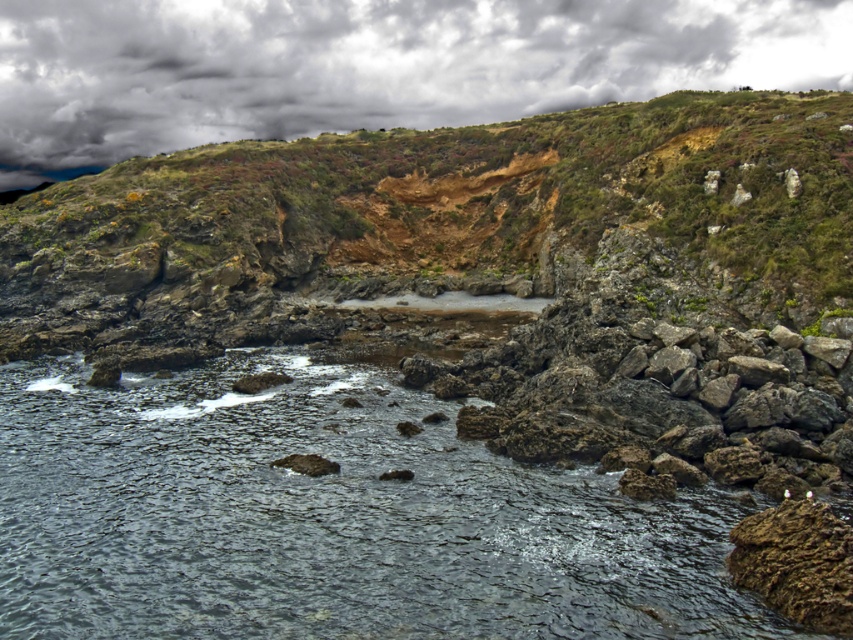
Question: Is dark gray water at center closer to the viewer compared to rugged rock cliff at center?

Choices:
 (A) no
 (B) yes

Answer: (B)

Question: Where is rugged rock cliff at center located in relation to cloudy gray sky at upper center in the image?

Choices:
 (A) below
 (B) above

Answer: (A)

Question: Considering the real-world distances, which object is closest to the dark gray water at center?

Choices:
 (A) rugged rock cliff at center
 (B) cloudy gray sky at upper center
 (C) rough stone cliff at center

Answer: (C)

Question: Which object is closer to the camera taking this photo?

Choices:
 (A) rough stone cliff at center
 (B) rugged rock cliff at center

Answer: (A)

Question: Is dark gray water at center to the left of cloudy gray sky at upper center from the viewer's perspective?

Choices:
 (A) yes
 (B) no

Answer: (A)

Question: Which object is positioned farthest from the cloudy gray sky at upper center?

Choices:
 (A) rugged rock cliff at center
 (B) dark gray water at center
 (C) rough stone cliff at center

Answer: (B)